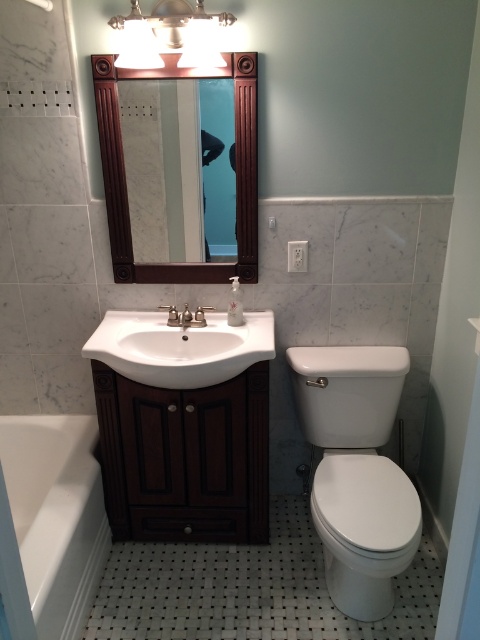
Question: Among these points, which one is nearest to the camera?

Choices:
 (A) (101, 60)
 (B) (188, 316)
 (C) (228, 406)

Answer: (A)

Question: In this image, where is white glossy bathtub at lower left located relative to silver metallic faucet at sink center?

Choices:
 (A) below
 (B) above

Answer: (A)

Question: Can you confirm if white glossy toilet at lower right is positioned to the left of white ceramic sink at center?

Choices:
 (A) no
 (B) yes

Answer: (A)

Question: Does dark wood cabinet at lower left appear over white glossy toilet at lower right?

Choices:
 (A) no
 (B) yes

Answer: (B)

Question: Considering the real-world distances, which object is farthest from the dark wood cabinet at lower left?

Choices:
 (A) mahogany wood mirror at upper center
 (B) white glossy bathtub at lower left

Answer: (A)

Question: Which of the following is the closest to the observer?

Choices:
 (A) (180, 70)
 (B) (204, 499)

Answer: (A)